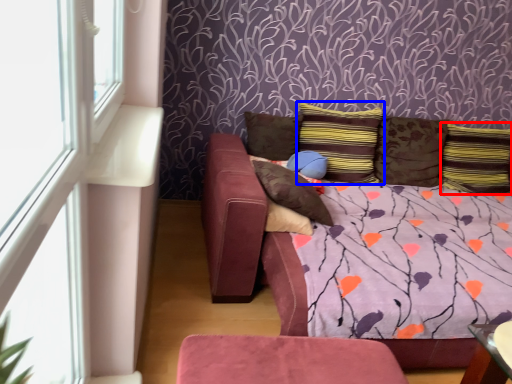
Question: Which point is further to the camera, pillow (highlighted by a red box) or pillow (highlighted by a blue box)?

Choices:
 (A) pillow
 (B) pillow

Answer: (A)